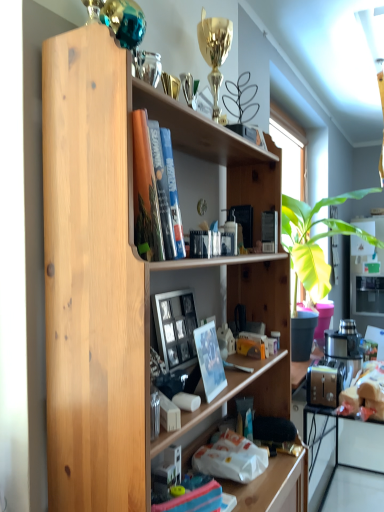
What is the approximate width of white glossy computer at lower right?

It is 16.27 inches.

Locate an element on the screen. The height and width of the screenshot is (512, 384). natural wood bookshelf at center is located at coordinates (126, 273).

Measure the distance between point (222, 362) and camera.

A distance of 3.91 feet exists between point (222, 362) and camera.

This screenshot has height=512, width=384. Describe the element at coordinates (209, 360) in the screenshot. I see `matte white photo frame at center` at that location.

In order to face wooden picture frame at center, should I rotate leftwards or rightwards?

To face it directly, rotate left by 1.457 degrees.

Find the location of a particular element. The height and width of the screenshot is (512, 384). white glossy computer at lower right is located at coordinates (338, 448).

Could you tell me if matte white photo frame at center is facing natural wood bookshelf at center?

Yes, matte white photo frame at center faces towards natural wood bookshelf at center.

Measure the distance from matte white photo frame at center to natural wood bookshelf at center.

matte white photo frame at center is 35.88 centimeters away from natural wood bookshelf at center.

Considering the positions of objects matte white photo frame at center and natural wood bookshelf at center in the image provided, who is in front, matte white photo frame at center or natural wood bookshelf at center?

natural wood bookshelf at center is closer to the camera.

Could natural wood bookshelf at center be considered to be inside matte white photo frame at center?

No, natural wood bookshelf at center is not a part of matte white photo frame at center.

Where is `paperback book in front of the wooden picture frame at center`? The height and width of the screenshot is (512, 384). paperback book in front of the wooden picture frame at center is located at coordinates (209, 360).

From the image's perspective, does wooden picture frame at center appear lower than matte white photo frame at center?

Actually, wooden picture frame at center appears above matte white photo frame at center in the image.

In the scene shown: How many degrees apart are the facing directions of wooden picture frame at center and matte white photo frame at center?

wooden picture frame at center and matte white photo frame at center are facing 7.38 degrees away from each other.

Are wooden picture frame at center and matte white photo frame at center located far from each other?

They are positioned close to each other.

Identify the location of shelf on the left of white glossy computer at lower right. The width and height of the screenshot is (384, 512). (126, 273).

Could you tell me if white glossy computer at lower right is turned towards natural wood bookshelf at center?

No, white glossy computer at lower right is not turned towards natural wood bookshelf at center.

Considering the positions of points (348, 450) and (74, 46), is point (348, 450) closer to camera compared to point (74, 46)?

No, (348, 450) is further to viewer.

Does white glossy computer at lower right have a lesser height compared to natural wood bookshelf at center?

Yes.

Between wooden picture frame at center and natural wood bookshelf at center, which one has larger width?

natural wood bookshelf at center.

Can you tell me how much wooden picture frame at center and natural wood bookshelf at center differ in facing direction?

They differ by 0.437 degrees in their facing directions.

Find the location of a particular element. shelf on the right of wooden picture frame at center is located at coordinates (126, 273).

Which of these two, wooden picture frame at center or natural wood bookshelf at center, stands taller?

natural wood bookshelf at center is taller.

Is natural wood bookshelf at center spatially inside white glossy computer at lower right, or outside of it?

natural wood bookshelf at center exists outside the volume of white glossy computer at lower right.

Based on the photo, is natural wood bookshelf at center in contact with white glossy computer at lower right?

natural wood bookshelf at center and white glossy computer at lower right are not in contact.

Is white glossy computer at lower right at the back of natural wood bookshelf at center?

No, natural wood bookshelf at center is not facing away from white glossy computer at lower right.

Is white glossy computer at lower right completely or partially inside wooden picture frame at center?

No, wooden picture frame at center does not contain white glossy computer at lower right.

From the image's perspective, which object appears higher, wooden picture frame at center or white glossy computer at lower right?

From the image's view, wooden picture frame at center is above.

Does wooden picture frame at center appear on the left side of white glossy computer at lower right?

Indeed, wooden picture frame at center is positioned on the left side of white glossy computer at lower right.

Who is taller, wooden picture frame at center or white glossy computer at lower right?

Standing taller between the two is wooden picture frame at center.

Is point (357, 456) closer or farther from the camera than point (213, 330)?

Clearly, point (357, 456) is more distant from the camera than point (213, 330).

Is white glossy computer at lower right facing towards matte white photo frame at center?

No.

Looking at this image, who is shorter, white glossy computer at lower right or matte white photo frame at center?

Standing shorter between the two is white glossy computer at lower right.

Is white glossy computer at lower right not inside matte white photo frame at center?

Yes, white glossy computer at lower right is located beyond the bounds of matte white photo frame at center.

Where is `paperback book above the natural wood bookshelf at center (from the image's perspective)`? paperback book above the natural wood bookshelf at center (from the image's perspective) is located at coordinates (209, 360).

You are a GUI agent. You are given a task and a screenshot of the screen. Output one action in this format:
    pyautogui.click(x=<x>, y=<y>)
    Task: Click on the picture frame above the matte white photo frame at center (from a real-world perspective)
    The width and height of the screenshot is (384, 512).
    Given the screenshot: What is the action you would take?
    pyautogui.click(x=175, y=327)

Considering their positions, is white glossy computer at lower right positioned further to wooden picture frame at center than natural wood bookshelf at center?

white glossy computer at lower right is positioned further to the anchor wooden picture frame at center.

Which object lies nearer to the anchor point wooden picture frame at center, white glossy computer at lower right or matte white photo frame at center?

matte white photo frame at center lies closer to wooden picture frame at center than the other object.

Based on the photo, considering their positions, is natural wood bookshelf at center positioned closer to matte white photo frame at center than wooden picture frame at center?

Based on the image, wooden picture frame at center appears to be nearer to matte white photo frame at center.

Consider the image. When comparing their distances from matte white photo frame at center, does white glossy computer at lower right or natural wood bookshelf at center seem closer?

natural wood bookshelf at center is positioned closer to the anchor matte white photo frame at center.

Considering their positions, is natural wood bookshelf at center positioned further to matte white photo frame at center than white glossy computer at lower right?

white glossy computer at lower right is further to matte white photo frame at center.

Considering their positions, is wooden picture frame at center positioned further to white glossy computer at lower right than matte white photo frame at center?

The object further to white glossy computer at lower right is matte white photo frame at center.

Which object lies further to the anchor point natural wood bookshelf at center, white glossy computer at lower right or matte white photo frame at center?

Among the two, white glossy computer at lower right is located further to natural wood bookshelf at center.

Estimate the real-world distances between objects in this image. Which object is closer to matte white photo frame at center, wooden picture frame at center or white glossy computer at lower right?

wooden picture frame at center lies closer to matte white photo frame at center than the other object.

Locate an element on the screen. This screenshot has width=384, height=512. paperback book positioned between natural wood bookshelf at center and white glossy computer at lower right from near to far is located at coordinates (209, 360).

Identify the location of paperback book between natural wood bookshelf at center and wooden picture frame at center from front to back. The height and width of the screenshot is (512, 384). (209, 360).

Identify the location of picture frame between natural wood bookshelf at center and white glossy computer at lower right from front to back. (175, 327).

Identify the location of paperback book between wooden picture frame at center and white glossy computer at lower right in the up-down direction. Image resolution: width=384 pixels, height=512 pixels. (209, 360).